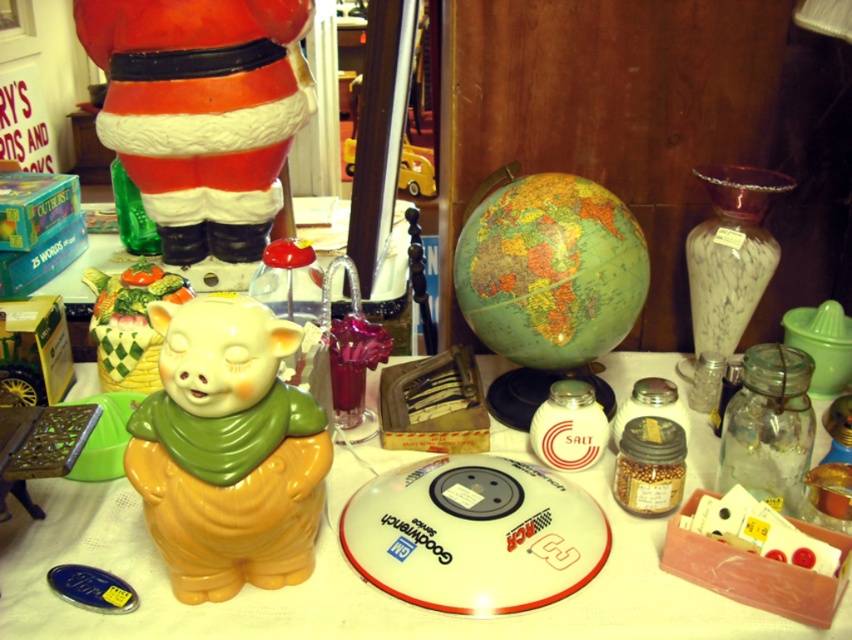
Question: Which object appears farthest from the camera in this image?

Choices:
 (A) matte ceramic piggy bank at center-left
 (B) red glossy santa at upper left
 (C) matte ceramic piggy bank at lower left
 (D) matte ceramic pig at center

Answer: (B)

Question: Can you confirm if matte ceramic piggy bank at center-left is positioned to the right of matte ceramic pig at center?

Choices:
 (A) no
 (B) yes

Answer: (B)

Question: From the image, what is the correct spatial relationship of matte ceramic piggy bank at center-left in relation to matte ceramic piggy bank at lower left?

Choices:
 (A) left
 (B) right

Answer: (B)

Question: Can you confirm if matte ceramic piggy bank at center-left is positioned below red glossy santa at upper left?

Choices:
 (A) yes
 (B) no

Answer: (A)

Question: Which point is farther to the camera?

Choices:
 (A) (122, 292)
 (B) (170, 232)
 (C) (96, 515)

Answer: (B)

Question: Considering the real-world distances, which object is farthest from the matte ceramic pig at center?

Choices:
 (A) red glossy santa at upper left
 (B) matte ceramic piggy bank at center-left
 (C) matte ceramic piggy bank at lower left

Answer: (C)